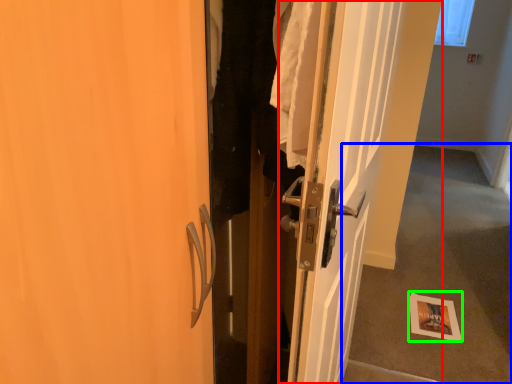
Question: Which is farther away from door (highlighted by a red box)? corridor (highlighted by a blue box) or postcard (highlighted by a green box)?

Choices:
 (A) corridor
 (B) postcard

Answer: (A)